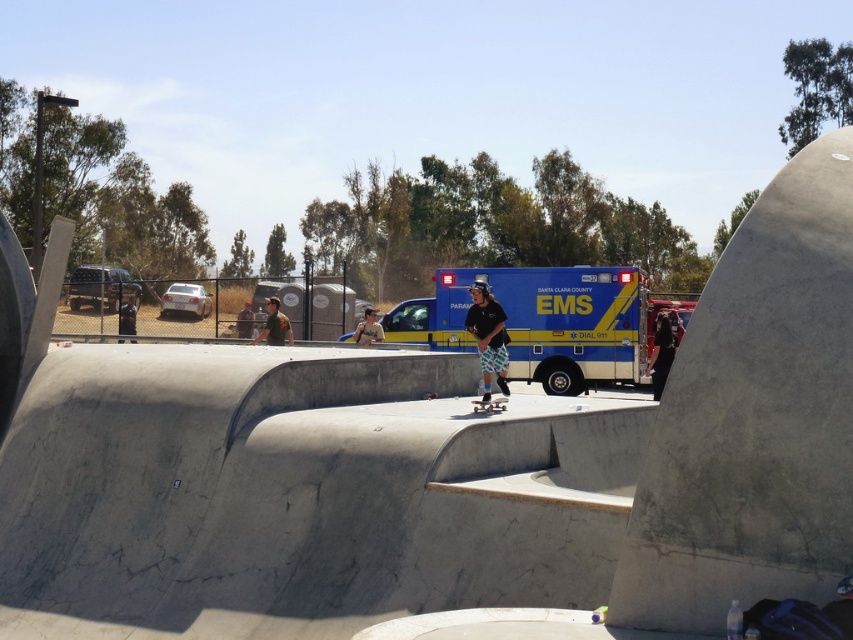
Question: Which is farther from the blue/white fiberglass ambulance at center?

Choices:
 (A) camouflage uniform at center
 (B) wooden skateboard at center

Answer: (B)

Question: Can you confirm if blue/white fiberglass ambulance at center is positioned above camouflage fabric shirt at center?

Choices:
 (A) no
 (B) yes

Answer: (B)

Question: Is brushed metal ambulance at center below wooden skateboard at center?

Choices:
 (A) no
 (B) yes

Answer: (A)

Question: Among these objects, which one is farthest from the camera?

Choices:
 (A) silver metallic car at center-left
 (B) black fabric pants at right
 (C) camouflage fabric shirt at center
 (D) brushed metal ambulance at center

Answer: (D)

Question: Which object is the farthest from the blue/white fiberglass ambulance at center?

Choices:
 (A) silver metallic car at center-left
 (B) black fabric pants at right
 (C) camouflage uniform at center
 (D) dark blue jeans at center

Answer: (D)

Question: Where is blue/white fiberglass ambulance at center located in relation to matte black skateboarder at center in the image?

Choices:
 (A) left
 (B) right

Answer: (B)